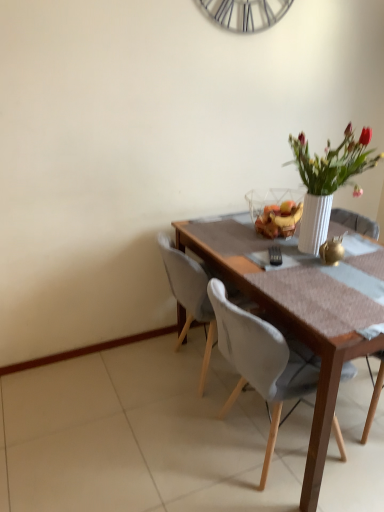
Describe the element at coordinates (262, 360) in the screenshot. I see `white fabric chair at center, which is counted as the second chair, starting from the right` at that location.

What do you see at coordinates (190, 296) in the screenshot?
I see `white fabric chair at center, acting as the 1th chair starting from the left` at bounding box center [190, 296].

Describe the element at coordinates (355, 222) in the screenshot. I see `wooden chair at right, which is the 1th chair in right-to-left order` at that location.

Identify the location of white fabric chair at center, which ranks as the 2th chair in left-to-right order. The image size is (384, 512). (262, 360).

From a real-world perspective, is white fabric chair at center, which ranks as the 2th chair in left-to-right order, on top of wooden chair at right, positioned as the third chair in left-to-right order?

Yes, from a real-world perspective, white fabric chair at center, which ranks as the 2th chair in left-to-right order, is on top of wooden chair at right, positioned as the third chair in left-to-right order.

Is white fabric chair at center, which is counted as the second chair, starting from the right, in contact with wooden chair at right, positioned as the third chair in left-to-right order?

No, white fabric chair at center, which is counted as the second chair, starting from the right, is not next to wooden chair at right, positioned as the third chair in left-to-right order.

Considering the positions of points (221, 282) and (376, 400), is point (221, 282) closer to camera compared to point (376, 400)?

Yes, it is.

Which is more to the right, white fabric chair at center, which is counted as the second chair, starting from the right, or wooden chair at right, which is the 1th chair in right-to-left order?

wooden chair at right, which is the 1th chair in right-to-left order, is more to the right.

What are the coordinates of `chair that is the 1st object located below the white fabric chair at center, which is counted as the third chair, starting from the right (from the image's perspective)` in the screenshot? It's located at (355, 222).

From a real-world perspective, is wooden chair at right, positioned as the third chair in left-to-right order, above or below white fabric chair at center, which is counted as the third chair, starting from the right?

From a real-world perspective, wooden chair at right, positioned as the third chair in left-to-right order, is physically below white fabric chair at center, which is counted as the third chair, starting from the right.

In the scene shown: From the image's perspective, which object appears higher, wooden chair at right, which is the 1th chair in right-to-left order, or white fabric chair at center, which is counted as the third chair, starting from the right?

From the image's view, white fabric chair at center, which is counted as the third chair, starting from the right, is above.

Considering the relative sizes of wooden chair at right, positioned as the third chair in left-to-right order, and white fabric chair at center, acting as the 1th chair starting from the left, in the image provided, is wooden chair at right, positioned as the third chair in left-to-right order, smaller than white fabric chair at center, acting as the 1th chair starting from the left,?

No.

The width and height of the screenshot is (384, 512). What are the coordinates of `chair below the white fabric chair at center, acting as the 1th chair starting from the left (from a real-world perspective)` in the screenshot? It's located at click(x=355, y=222).

How far apart are white fabric chair at center, acting as the 1th chair starting from the left, and wooden chair at right, positioned as the third chair in left-to-right order?

They are 36.16 inches apart.

Is white fabric chair at center, which is counted as the third chair, starting from the right, surrounding wooden chair at right, which is the 1th chair in right-to-left order?

That's incorrect, wooden chair at right, which is the 1th chair in right-to-left order, is not inside white fabric chair at center, which is counted as the third chair, starting from the right.

Which is more to the right, white fabric chair at center, acting as the 1th chair starting from the left, or wooden chair at right, positioned as the third chair in left-to-right order?

wooden chair at right, positioned as the third chair in left-to-right order.

Does white fabric chair at center, acting as the 1th chair starting from the left, have a greater height compared to white fabric chair at center, which ranks as the 2th chair in left-to-right order?

No, white fabric chair at center, acting as the 1th chair starting from the left, is not taller than white fabric chair at center, which ranks as the 2th chair in left-to-right order.

Is white fabric chair at center, acting as the 1th chair starting from the left, at the right side of white fabric chair at center, which is counted as the second chair, starting from the right?

No, white fabric chair at center, acting as the 1th chair starting from the left, is not to the right of white fabric chair at center, which is counted as the second chair, starting from the right.

From a real-world perspective, between white fabric chair at center, which is counted as the third chair, starting from the right, and white fabric chair at center, which is counted as the second chair, starting from the right, who is vertically lower?

white fabric chair at center, which is counted as the third chair, starting from the right, from a real-world perspective.

Is white fabric chair at center, acting as the 1th chair starting from the left, beside white fabric chair at center, which ranks as the 2th chair in left-to-right order?

No, white fabric chair at center, acting as the 1th chair starting from the left, is not beside white fabric chair at center, which ranks as the 2th chair in left-to-right order.

Is wooden chair at right, positioned as the third chair in left-to-right order, to the left of white fabric chair at center, which ranks as the 2th chair in left-to-right order, from the viewer's perspective?

Incorrect, wooden chair at right, positioned as the third chair in left-to-right order, is not on the left side of white fabric chair at center, which ranks as the 2th chair in left-to-right order.

Which of these two, wooden chair at right, which is the 1th chair in right-to-left order, or white fabric chair at center, which is counted as the second chair, starting from the right, is bigger?

white fabric chair at center, which is counted as the second chair, starting from the right.

Which object is closer to the camera taking this photo, wooden chair at right, which is the 1th chair in right-to-left order, or white fabric chair at center, which is counted as the second chair, starting from the right?

Positioned in front is white fabric chair at center, which is counted as the second chair, starting from the right.

From the image's perspective, relative to white fabric chair at center, which ranks as the 2th chair in left-to-right order, is wooden chair at right, positioned as the third chair in left-to-right order, above or below?

Clearly, from the image's perspective, wooden chair at right, positioned as the third chair in left-to-right order, is above white fabric chair at center, which ranks as the 2th chair in left-to-right order.

Between white fabric chair at center, which is counted as the second chair, starting from the right, and white fabric chair at center, acting as the 1th chair starting from the left, which one appears on the right side from the viewer's perspective?

Positioned to the right is white fabric chair at center, which is counted as the second chair, starting from the right.

Which is behind, point (244, 340) or point (208, 340)?

The point (208, 340) is behind.

Looking at this image, from a real-world perspective, relative to white fabric chair at center, which is counted as the third chair, starting from the right, is white fabric chair at center, which is counted as the second chair, starting from the right, vertically above or below?

In terms of real-world spatial position, white fabric chair at center, which is counted as the second chair, starting from the right, is above white fabric chair at center, which is counted as the third chair, starting from the right.

Is white fabric chair at center, which is counted as the second chair, starting from the right, positioned with its back to white fabric chair at center, which is counted as the third chair, starting from the right?

No, white fabric chair at center, which is counted as the third chair, starting from the right, is not at the back of white fabric chair at center, which is counted as the second chair, starting from the right.

From a real-world perspective, starting from the wooden chair at right, which is the 1th chair in right-to-left order, which chair is the 2nd one vertically above it? Please provide its 2D coordinates.

[(262, 360)]

Where is `the 1st chair in front of the white fabric chair at center, acting as the 1th chair starting from the left, counting from the anchor's position`? This screenshot has height=512, width=384. the 1st chair in front of the white fabric chair at center, acting as the 1th chair starting from the left, counting from the anchor's position is located at coordinates (355, 222).

Estimate the real-world distances between objects in this image. Which object is closer to white fabric chair at center, which is counted as the second chair, starting from the right, white fabric chair at center, which is counted as the third chair, starting from the right, or wooden chair at right, positioned as the third chair in left-to-right order?

white fabric chair at center, which is counted as the third chair, starting from the right, is closer to white fabric chair at center, which is counted as the second chair, starting from the right.

From the image, which object appears to be nearer to white fabric chair at center, which is counted as the third chair, starting from the right, white fabric chair at center, which is counted as the second chair, starting from the right, or wooden chair at right, which is the 1th chair in right-to-left order?

Based on the image, white fabric chair at center, which is counted as the second chair, starting from the right, appears to be nearer to white fabric chair at center, which is counted as the third chair, starting from the right.

Which object lies nearer to the anchor point white fabric chair at center, acting as the 1th chair starting from the left, wooden chair at right, which is the 1th chair in right-to-left order, or white fabric chair at center, which is counted as the second chair, starting from the right?

white fabric chair at center, which is counted as the second chair, starting from the right, lies closer to white fabric chair at center, acting as the 1th chair starting from the left, than the other object.

Estimate the real-world distances between objects in this image. Which object is further from wooden chair at right, which is the 1th chair in right-to-left order, white fabric chair at center, acting as the 1th chair starting from the left, or white fabric chair at center, which ranks as the 2th chair in left-to-right order?

white fabric chair at center, which ranks as the 2th chair in left-to-right order, is positioned further to the anchor wooden chair at right, which is the 1th chair in right-to-left order.

When comparing their distances from wooden chair at right, which is the 1th chair in right-to-left order, does white fabric chair at center, which is counted as the second chair, starting from the right, or white fabric chair at center, acting as the 1th chair starting from the left, seem closer?

Based on the image, white fabric chair at center, acting as the 1th chair starting from the left, appears to be nearer to wooden chair at right, which is the 1th chair in right-to-left order.

Based on their spatial positions, is wooden chair at right, which is the 1th chair in right-to-left order, or white fabric chair at center, which is counted as the third chair, starting from the right, further from white fabric chair at center, which is counted as the second chair, starting from the right?

The object further to white fabric chair at center, which is counted as the second chair, starting from the right, is wooden chair at right, which is the 1th chair in right-to-left order.

This screenshot has height=512, width=384. Find the location of `chair situated between white fabric chair at center, which is counted as the third chair, starting from the right, and wooden chair at right, which is the 1th chair in right-to-left order, from left to right`. chair situated between white fabric chair at center, which is counted as the third chair, starting from the right, and wooden chair at right, which is the 1th chair in right-to-left order, from left to right is located at coordinates (262, 360).